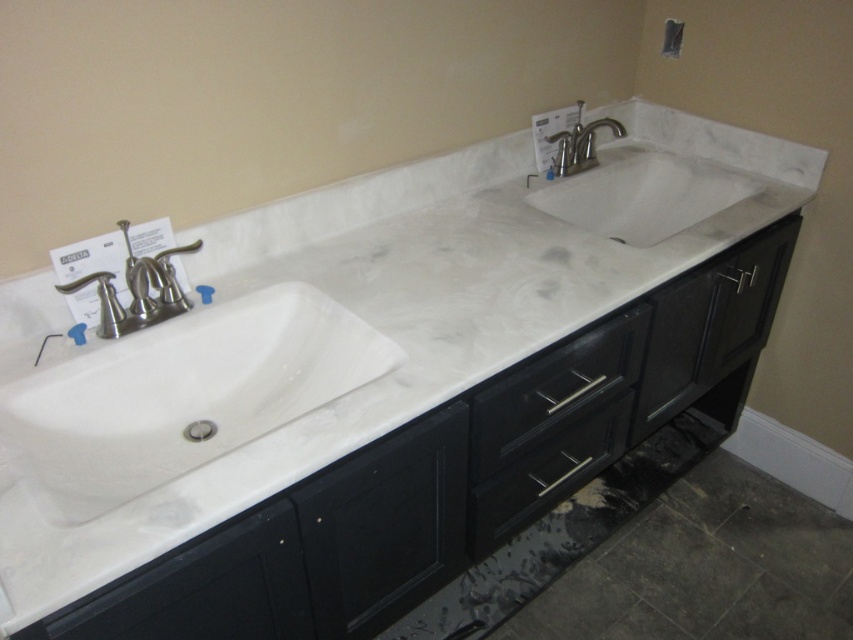
Question: Which of the following is the farthest from the observer?

Choices:
 (A) white marble sink at center
 (B) brushed nickel faucet at left
 (C) black matte drawer at center
 (D) white marble sink at left

Answer: (A)

Question: Is white marble sink at left below polished chrome faucet at upper center?

Choices:
 (A) yes
 (B) no

Answer: (A)

Question: Among these objects, which one is farthest from the camera?

Choices:
 (A) polished chrome faucet at upper center
 (B) brushed nickel faucet at left
 (C) white marble sink at left
 (D) black matte drawer at center

Answer: (A)

Question: Which of the following is the closest to the observer?

Choices:
 (A) (186, 396)
 (B) (541, 376)
 (C) (596, 120)

Answer: (B)

Question: Is white marble sink at center further to the viewer compared to brushed nickel faucet at left?

Choices:
 (A) no
 (B) yes

Answer: (B)

Question: Can you confirm if white marble sink at left is thinner than black matte drawer at center?

Choices:
 (A) yes
 (B) no

Answer: (B)